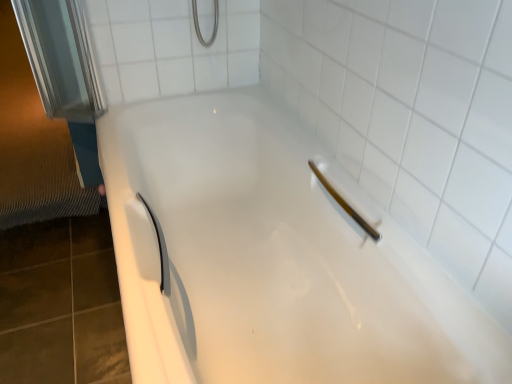
Question: Considering the relative sizes of white ceramic tile at upper center and matte white shower at upper right in the image provided, is white ceramic tile at upper center bigger than matte white shower at upper right?

Choices:
 (A) yes
 (B) no

Answer: (A)

Question: Is white ceramic tile at upper center positioned with its back to matte white shower at upper right?

Choices:
 (A) yes
 (B) no

Answer: (B)

Question: Is white ceramic tile at upper center to the right of matte white shower at upper right from the viewer's perspective?

Choices:
 (A) yes
 (B) no

Answer: (B)

Question: From the image's perspective, would you say white ceramic tile at upper center is positioned over matte white shower at upper right?

Choices:
 (A) yes
 (B) no

Answer: (A)

Question: Does white ceramic tile at upper center come behind matte white shower at upper right?

Choices:
 (A) yes
 (B) no

Answer: (A)

Question: From the image's perspective, is white ceramic tile at upper center located above or below white glossy bathtub at center?

Choices:
 (A) above
 (B) below

Answer: (A)

Question: Is white ceramic tile at upper center inside the boundaries of white glossy bathtub at center, or outside?

Choices:
 (A) outside
 (B) inside

Answer: (A)

Question: From a real-world perspective, is white ceramic tile at upper center physically located above or below white glossy bathtub at center?

Choices:
 (A) below
 (B) above

Answer: (B)

Question: Does point (248, 82) appear closer or farther from the camera than point (141, 241)?

Choices:
 (A) farther
 (B) closer

Answer: (A)

Question: Is white ceramic tile at upper center taller or shorter than matte white shower at upper right?

Choices:
 (A) short
 (B) tall

Answer: (B)

Question: From the image's perspective, is white ceramic tile at upper center above or below matte white shower at upper right?

Choices:
 (A) above
 (B) below

Answer: (A)

Question: Is white ceramic tile at upper center bigger or smaller than matte white shower at upper right?

Choices:
 (A) small
 (B) big

Answer: (B)

Question: Looking at their shapes, would you say white ceramic tile at upper center is wider or thinner than matte white shower at upper right?

Choices:
 (A) wide
 (B) thin

Answer: (B)

Question: Looking at the image, does matte white shower at upper right seem bigger or smaller compared to white ceramic tile at upper center?

Choices:
 (A) big
 (B) small

Answer: (B)

Question: Considering the positions of matte white shower at upper right and white ceramic tile at upper center in the image, is matte white shower at upper right wider or thinner than white ceramic tile at upper center?

Choices:
 (A) thin
 (B) wide

Answer: (B)